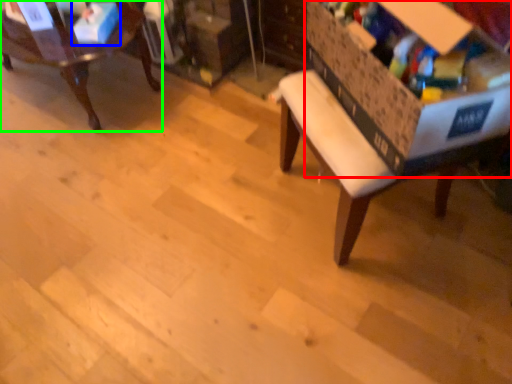
Question: Which object is the closest to the storage box (highlighted by a red box)? Choose among these: storage box (highlighted by a blue box) or chair (highlighted by a green box).

Choices:
 (A) storage box
 (B) chair

Answer: (B)